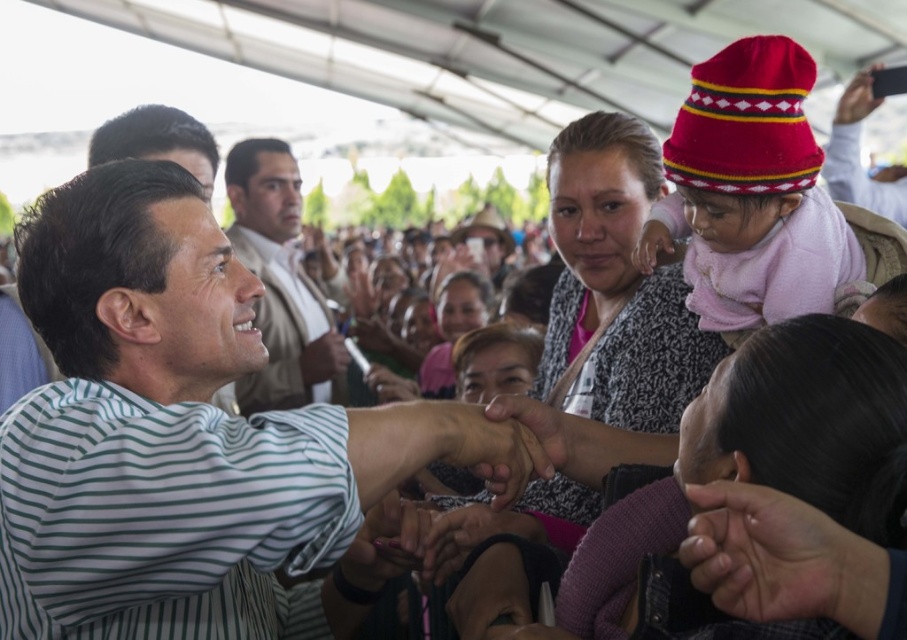
What is the color of the shirt worn by the person at the coordinates point (x=280, y=282)?

The point (x=280, y=282) is on smooth beige shirt at center, so the shirt is beige.

You are a photographer at this event and want to capture a photo of the white striped shirt at center and the smooth leather wallet at upper right in the same frame. Based on their positions, which object should you focus on first to ensure both are in the frame?

The white striped shirt at center is positioned on the left side of the smooth leather wallet at upper right, so you should focus on the white striped shirt at center first to ensure both are included in the frame.

You are at a social event and see the smooth beige shirt at center and the smooth leather wallet at upper right. Which object is positioned to the left of the other?

The smooth beige shirt at center is to the left of smooth leather wallet at upper right.